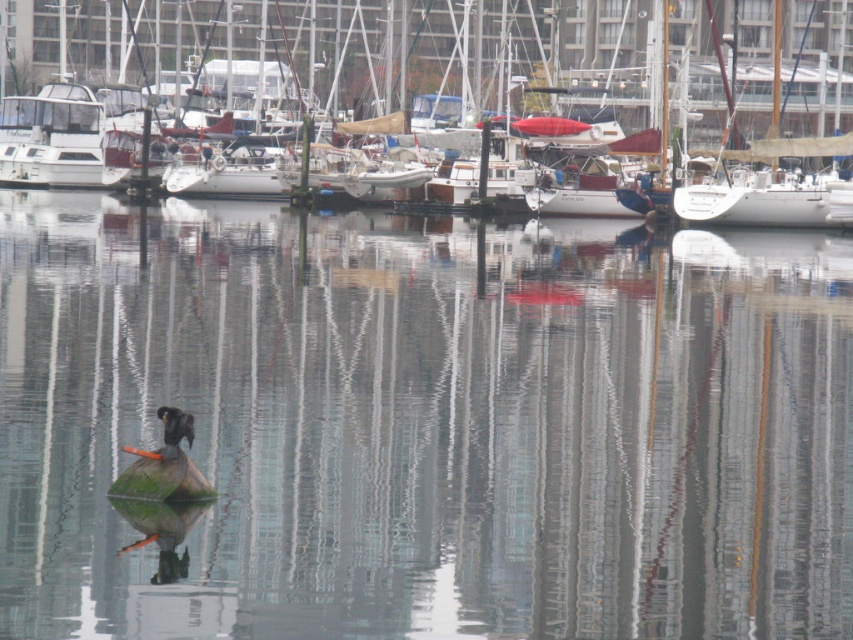
Can you confirm if white glossy sailboat at center is bigger than green fuzzy duck at center?

Indeed, white glossy sailboat at center has a larger size compared to green fuzzy duck at center.

Does point (218, 93) lie in front of point (177, 467)?

That is False.

Who is more distant from viewer, (x=596, y=51) or (x=173, y=442)?

The point (x=596, y=51) is behind.

Image resolution: width=853 pixels, height=640 pixels. Identify the location of white glossy sailboat at center. (346, 49).

Can you confirm if clear water at center is positioned below white glossy sailboat at center?

Yes.

Based on the photo, can you confirm if clear water at center is shorter than white glossy sailboat at center?

Yes.

You are a GUI agent. You are given a task and a screenshot of the screen. Output one action in this format:
    pyautogui.click(x=<x>, y=<y>)
    Task: Click on the clear water at center
    This screenshot has width=853, height=640.
    Given the screenshot: What is the action you would take?
    pyautogui.click(x=422, y=426)

How much distance is there between clear water at center and green fuzzy duck at center?

A distance of 34.56 feet exists between clear water at center and green fuzzy duck at center.

Which is more to the right, clear water at center or green fuzzy duck at center?

Positioned to the right is clear water at center.

Measure the distance between point (x=833, y=426) and camera.

Point (x=833, y=426) is 58.50 feet away from camera.

I want to click on clear water at center, so click(x=422, y=426).